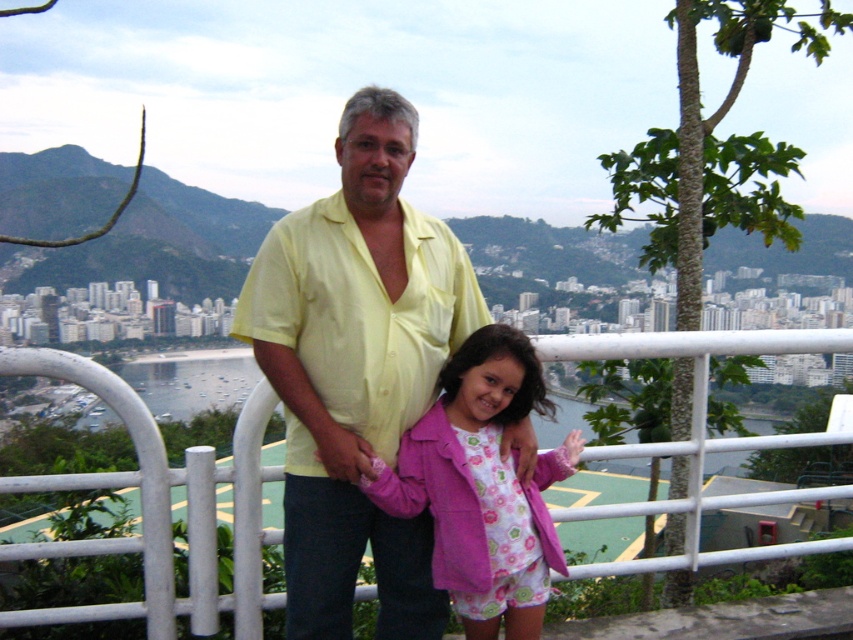
You are standing at the center of the scene and want to move towards the white metal fence at center. Which direction should you move relative to the pink fabric jacket at center?

You should move to the left of the pink fabric jacket at center to reach the white metal fence at center because the white metal fence at center is located to the left of the pink fabric jacket at center.

You are a photographer trying to capture a photo of the yellow smooth shirt at center and the white metal fence at center. Based on their sizes, which object should you focus on first to ensure both are in frame without zooming?

The yellow smooth shirt at center has a smaller size compared to the white metal fence at center, so you should focus on the yellow smooth shirt at center first to ensure it fits within the frame before adjusting for the larger fence.

You are a photographer trying to capture a photo of the yellow smooth shirt at center and the white metal fence at center. If the camera can only focus on objects wider than 50 cm, will both objects be in focus?

The yellow smooth shirt at center is less than 50 cm wide, so it might not be in focus. The white metal fence at center is wider than the shirt, so it should be in focus. However, since the camera requires objects wider than 50 cm to focus, only the white metal fence at center will be in focus.